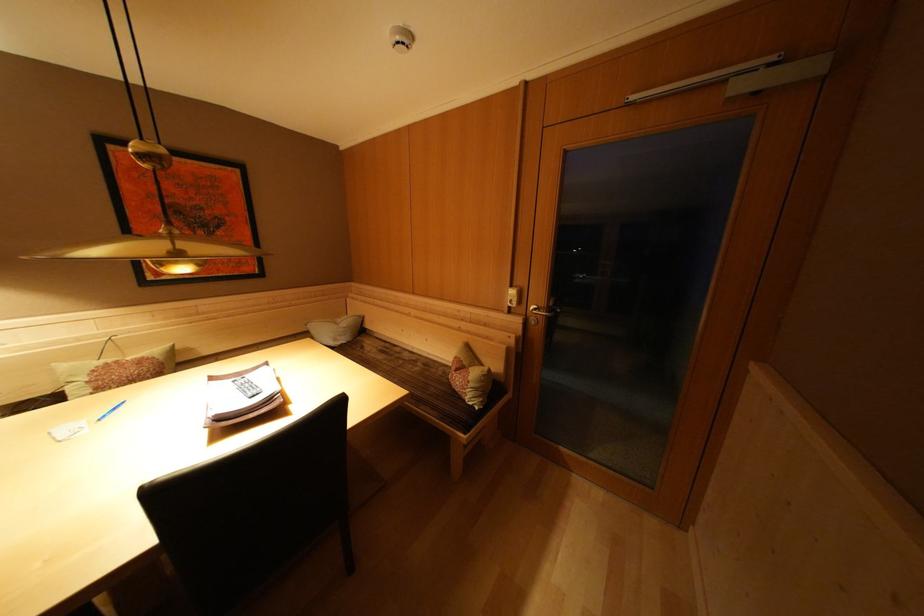
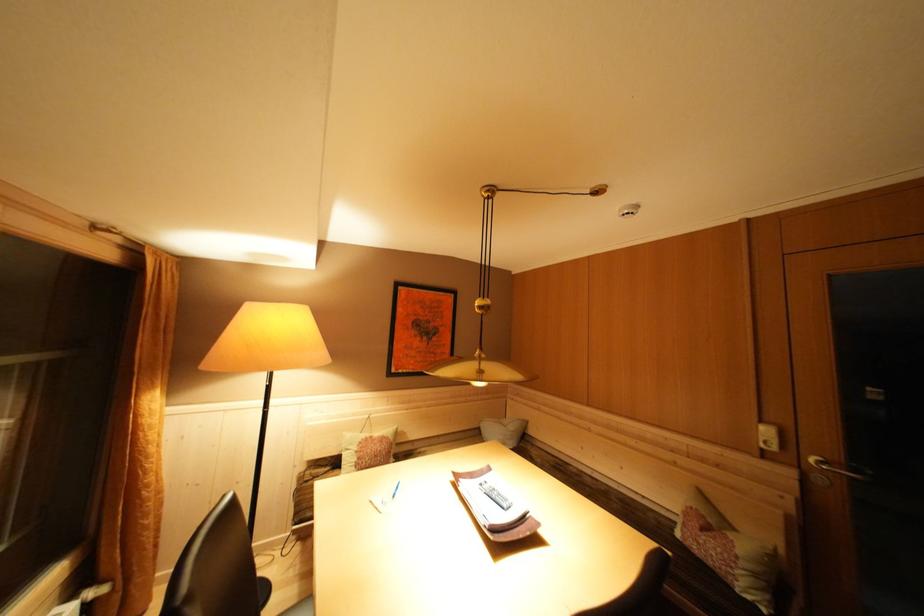
The point at (477, 383) is marked in the first image. Where is the corresponding point in the second image?

(746, 557)